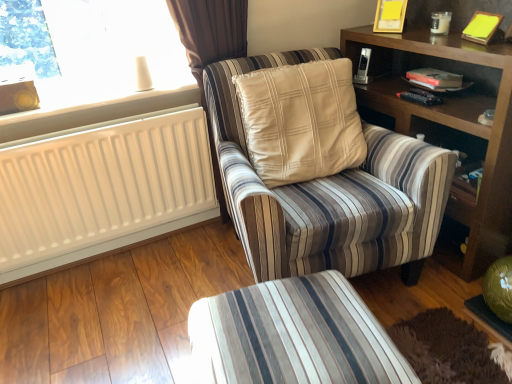
Question: Does white plastic radiator at upper left appear on the left side of wooden bookshelf at right?

Choices:
 (A) yes
 (B) no

Answer: (A)

Question: Is white plastic radiator at upper left to the right of wooden bookshelf at right from the viewer's perspective?

Choices:
 (A) no
 (B) yes

Answer: (A)

Question: Can you see white plastic radiator at upper left touching wooden bookshelf at right?

Choices:
 (A) no
 (B) yes

Answer: (A)

Question: Is white plastic radiator at upper left wider than wooden bookshelf at right?

Choices:
 (A) no
 (B) yes

Answer: (A)

Question: Is white plastic radiator at upper left positioned with its back to wooden bookshelf at right?

Choices:
 (A) no
 (B) yes

Answer: (A)

Question: Does white plastic radiator at upper left have a larger size compared to wooden bookshelf at right?

Choices:
 (A) yes
 (B) no

Answer: (B)

Question: Does white matte radiator at left turn towards wooden bookshelf at right?

Choices:
 (A) yes
 (B) no

Answer: (B)

Question: Does white matte radiator at left have a lesser height compared to wooden bookshelf at right?

Choices:
 (A) no
 (B) yes

Answer: (B)

Question: From the image's perspective, is white matte radiator at left beneath wooden bookshelf at right?

Choices:
 (A) yes
 (B) no

Answer: (A)

Question: Is white matte radiator at left at the right side of wooden bookshelf at right?

Choices:
 (A) no
 (B) yes

Answer: (A)

Question: Is white matte radiator at left at the left side of wooden bookshelf at right?

Choices:
 (A) yes
 (B) no

Answer: (A)

Question: Can wooden bookshelf at right be found inside white matte radiator at left?

Choices:
 (A) yes
 (B) no

Answer: (B)

Question: Does yellow paper at upper right appear on the right side of wooden bookshelf at right?

Choices:
 (A) no
 (B) yes

Answer: (B)